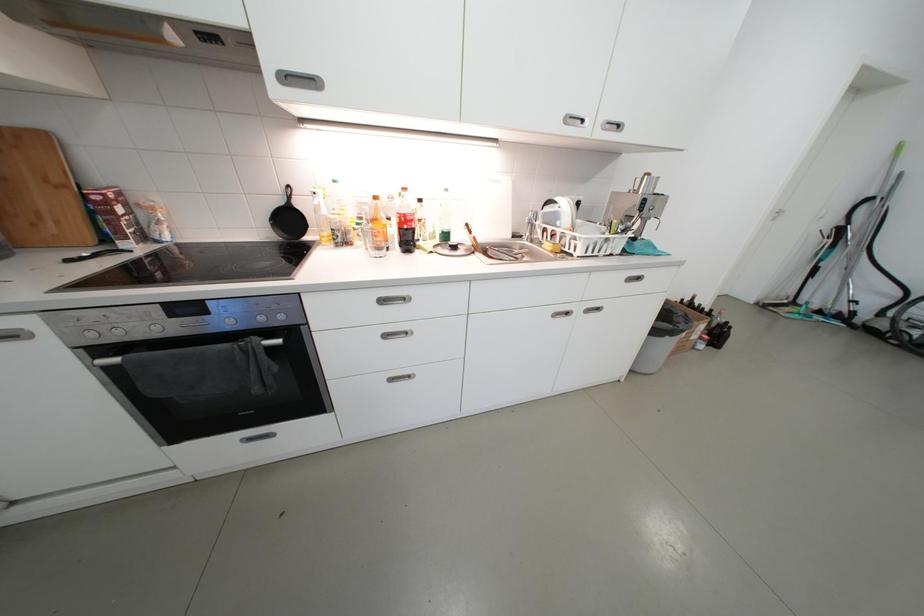
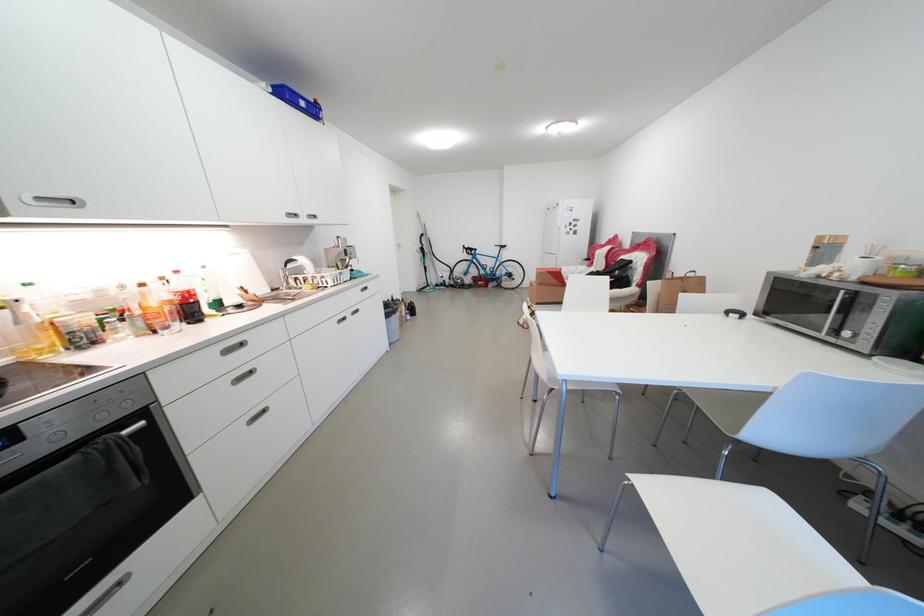
Question: How did the camera likely rotate?

Choices:
 (A) Left
 (B) Right
 (C) Up
 (D) Down

Answer: (B)